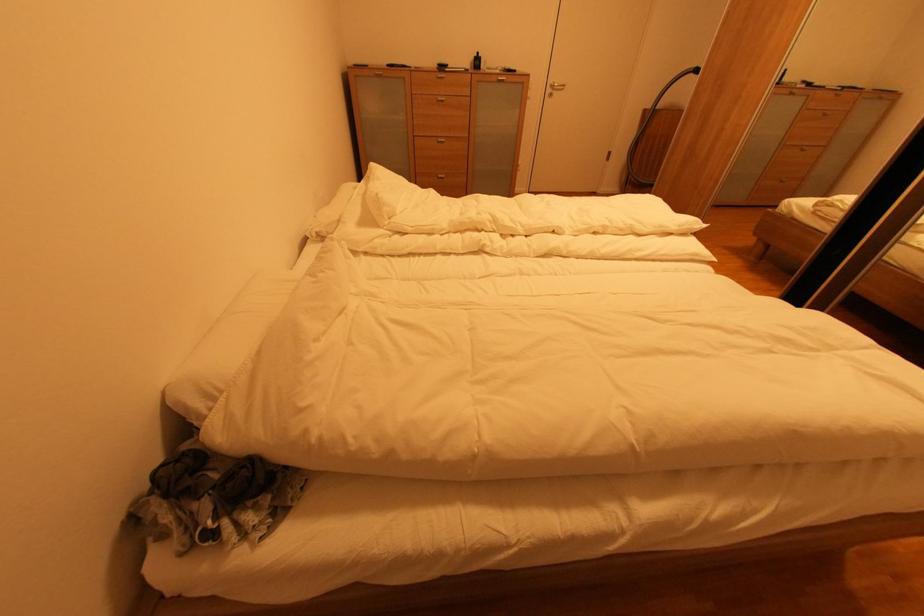
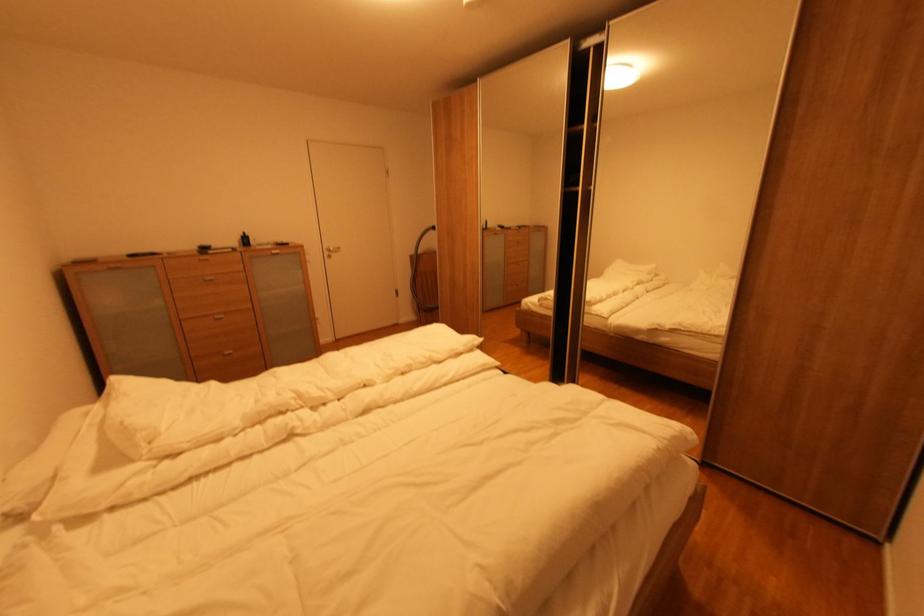
In the second image, find the point that corresponds to (x=445, y=102) in the first image.

(213, 282)